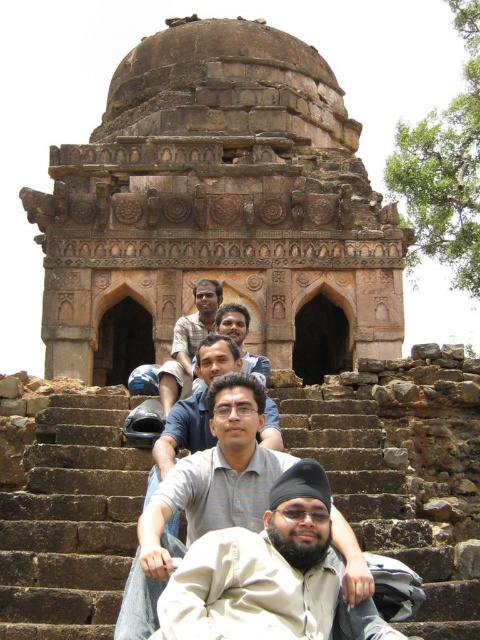
Is brown stone ruins at center to the right of light brown skin at center from the viewer's perspective?

Indeed, brown stone ruins at center is positioned on the right side of light brown skin at center.

Is brown stone ruins at center positioned at the back of light brown skin at center?

That is True.

Is point (44, 259) positioned behind point (188, 348)?

Yes, it is.

The height and width of the screenshot is (640, 480). In order to click on brown stone ruins at center in this screenshot , I will do `click(217, 209)`.

Is point (154, 609) positioned before point (176, 330)?

Yes, point (154, 609) is in front of point (176, 330).

Is point (148, 548) closer to camera compared to point (179, 394)?

Yes, it is in front of point (179, 394).

Where is `gray striped shirt at center`? gray striped shirt at center is located at coordinates (203, 497).

Which is more to the left, brown stone ruins at center or gray striped shirt at center?

brown stone ruins at center

Is point (398, 346) positioned behind point (144, 618)?

Yes, point (398, 346) is farther from viewer.

Where is `brown stone ruins at center`? brown stone ruins at center is located at coordinates (217, 209).